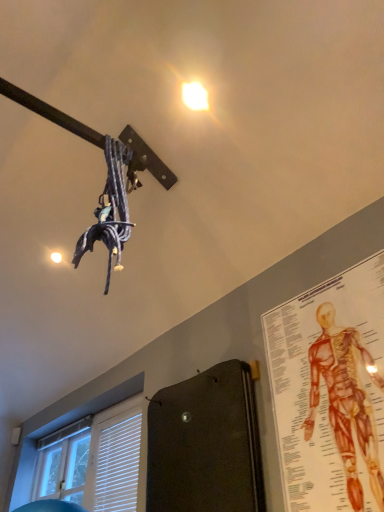
Question: Is anatomical chart at upper right looking in the opposite direction of white glossy droplight at upper center?

Choices:
 (A) no
 (B) yes

Answer: (A)

Question: Does anatomical chart at upper right appear on the left side of white glossy droplight at upper center?

Choices:
 (A) no
 (B) yes

Answer: (A)

Question: Considering the relative sizes of anatomical chart at upper right and white glossy droplight at upper center in the image provided, is anatomical chart at upper right bigger than white glossy droplight at upper center?

Choices:
 (A) yes
 (B) no

Answer: (A)

Question: From a real-world perspective, is anatomical chart at upper right physically below white glossy droplight at upper center?

Choices:
 (A) no
 (B) yes

Answer: (B)

Question: Considering the relative sizes of anatomical chart at upper right and white glossy droplight at upper center in the image provided, is anatomical chart at upper right shorter than white glossy droplight at upper center?

Choices:
 (A) yes
 (B) no

Answer: (B)

Question: From the image's perspective, is anatomical chart at upper right beneath white glossy droplight at upper center?

Choices:
 (A) yes
 (B) no

Answer: (A)

Question: Is white plastic blinds at lower left thinner than white glossy droplight at upper center?

Choices:
 (A) no
 (B) yes

Answer: (B)

Question: Is white plastic blinds at lower left not close to white glossy droplight at upper center?

Choices:
 (A) no
 (B) yes

Answer: (B)

Question: Considering the relative positions of white plastic blinds at lower left and white glossy droplight at upper center in the image provided, is white plastic blinds at lower left to the right of white glossy droplight at upper center from the viewer's perspective?

Choices:
 (A) no
 (B) yes

Answer: (A)

Question: Is white plastic blinds at lower left looking in the opposite direction of white glossy droplight at upper center?

Choices:
 (A) no
 (B) yes

Answer: (A)

Question: From a real-world perspective, is white plastic blinds at lower left positioned over white glossy droplight at upper center based on gravity?

Choices:
 (A) yes
 (B) no

Answer: (B)

Question: Can you confirm if white plastic blinds at lower left is taller than white glossy droplight at upper center?

Choices:
 (A) yes
 (B) no

Answer: (A)

Question: Would you say white glossy droplight at upper center is outside anatomical chart at upper right?

Choices:
 (A) no
 (B) yes

Answer: (B)